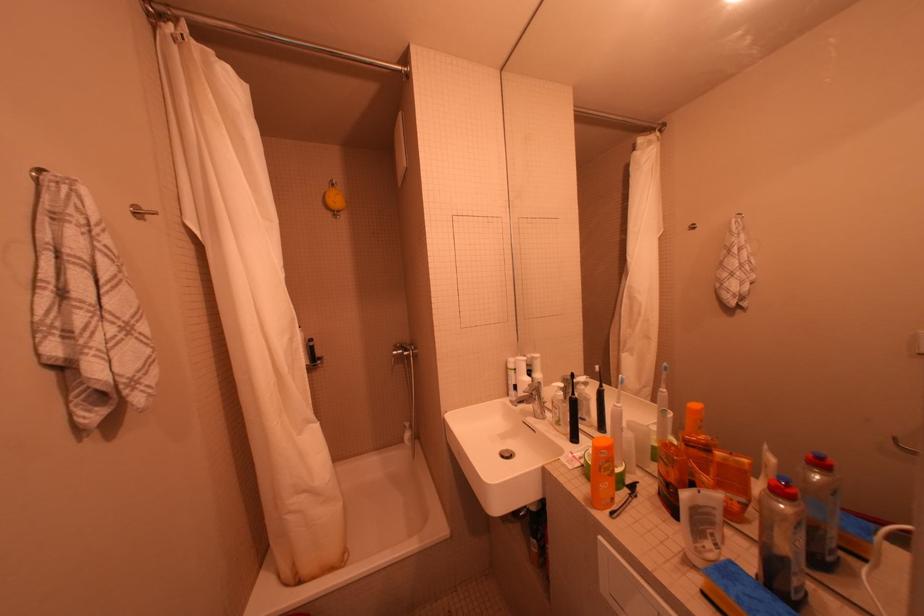
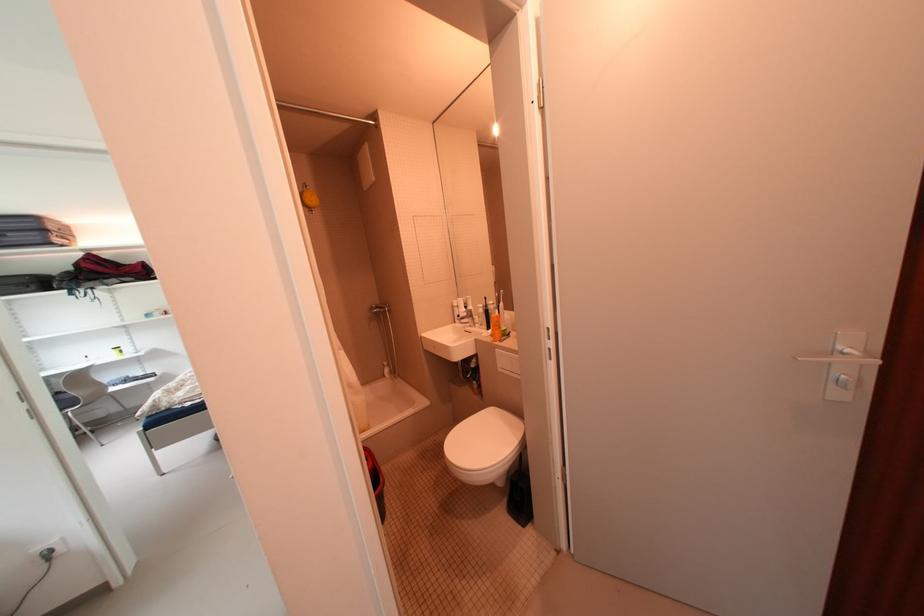
In the second image, find the point that corresponds to the point at 337,198 in the first image.

(314, 198)